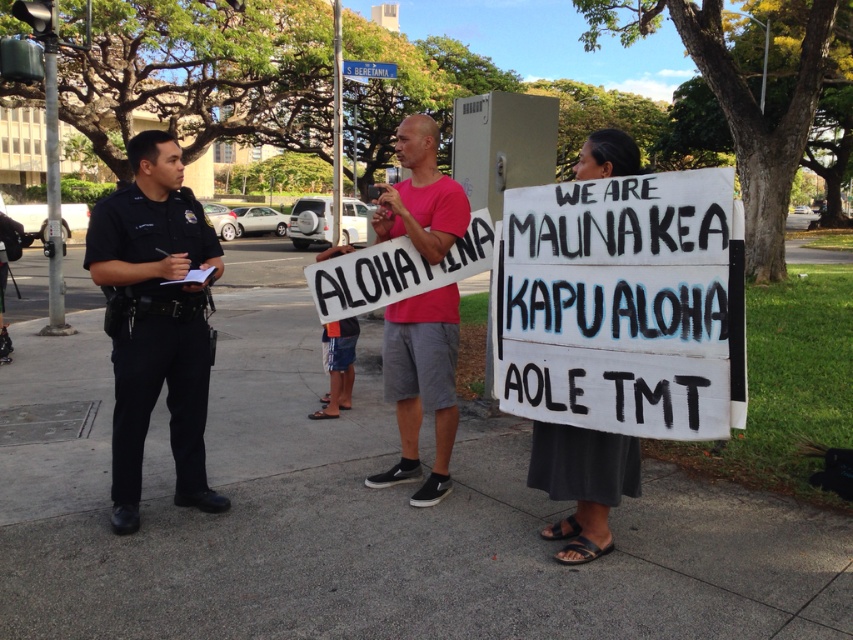
Can you confirm if gray concrete pavement at center is positioned above white painted wood sign at lower right?

Yes, gray concrete pavement at center is above white painted wood sign at lower right.

Does gray concrete pavement at center appear on the right side of white painted wood sign at lower right?

No, gray concrete pavement at center is not to the right of white painted wood sign at lower right.

Where is `gray concrete pavement at center`? Image resolution: width=853 pixels, height=640 pixels. gray concrete pavement at center is located at coordinates (368, 518).

The image size is (853, 640). What are the coordinates of `gray concrete pavement at center` in the screenshot? It's located at (368, 518).

This screenshot has width=853, height=640. Describe the element at coordinates (622, 305) in the screenshot. I see `white painted wood sign at lower right` at that location.

Is point (737, 426) closer to camera compared to point (442, 442)?

Yes, it is in front of point (442, 442).

At what (x,y) coordinates should I click in order to perform the action: click on white painted wood sign at lower right. Please return your answer as a coordinate pair (x, y). The image size is (853, 640). Looking at the image, I should click on (622, 305).

Between white painted wood sign at lower right and dark gray fabric skirt at lower right, which one appears on the left side from the viewer's perspective?

white painted wood sign at lower right

Is white painted wood sign at lower right bigger than dark gray fabric skirt at lower right?

No, white painted wood sign at lower right is not bigger than dark gray fabric skirt at lower right.

Is point (625, 192) positioned after point (592, 477)?

No, (625, 192) is in front of (592, 477).

Locate an element on the screen. The image size is (853, 640). white painted wood sign at lower right is located at coordinates (622, 305).